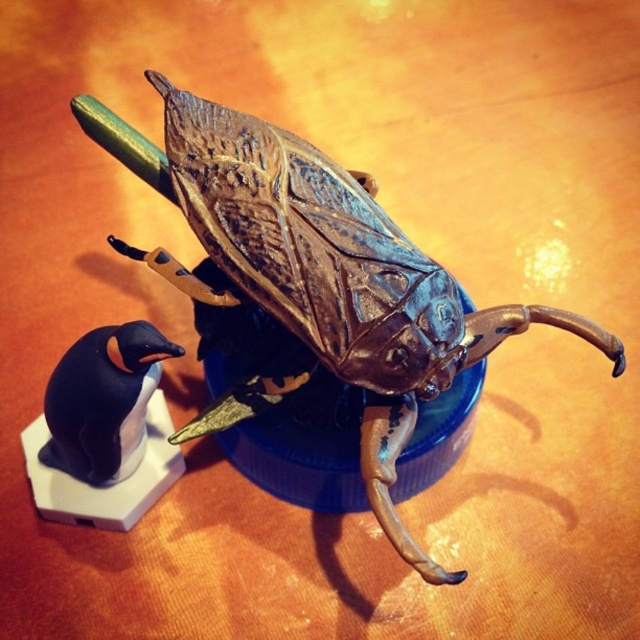
Question: Which of the following is the farthest from the observer?

Choices:
 (A) (380, 433)
 (B) (100, 444)

Answer: (B)

Question: Which of the following is the closest to the observer?

Choices:
 (A) (113, 380)
 (B) (321, 278)

Answer: (B)

Question: Is shiny metallic beetle at center to the right of black matte penguin at lower left from the viewer's perspective?

Choices:
 (A) no
 (B) yes

Answer: (B)

Question: Considering the relative positions of shiny metallic beetle at center and black matte penguin at lower left in the image provided, where is shiny metallic beetle at center located with respect to black matte penguin at lower left?

Choices:
 (A) left
 (B) right

Answer: (B)

Question: Among these objects, which one is nearest to the camera?

Choices:
 (A) shiny metallic beetle at center
 (B) black matte penguin at lower left

Answer: (A)

Question: Is shiny metallic beetle at center in front of black matte penguin at lower left?

Choices:
 (A) no
 (B) yes

Answer: (B)